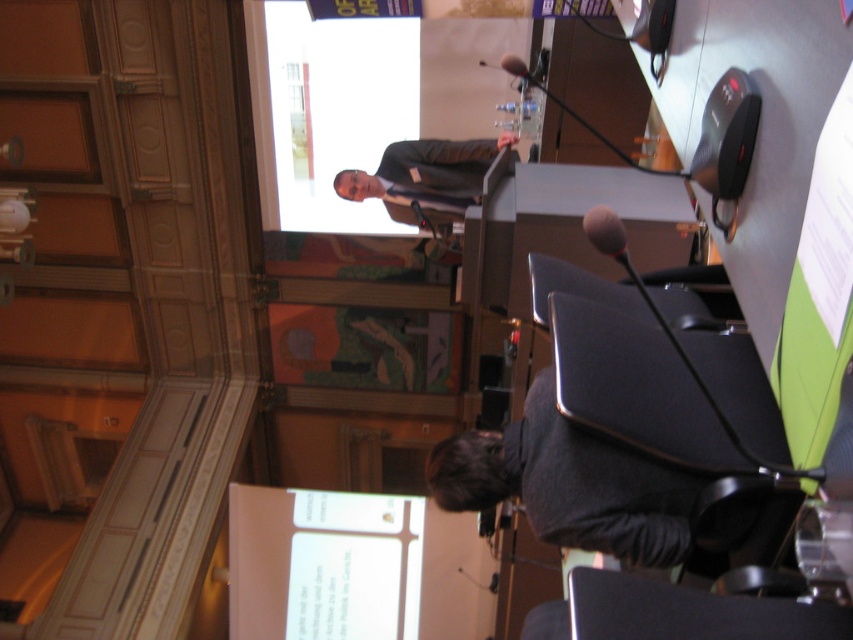
You are standing in the conference room and need to locate two specific points marked on the floor. The first point is at coordinate point(444, 483) and the second is at point(469, 161). Which point is closer to the large screen in the background?

Point(444, 483) is in front of point(469, 161), so it is closer to the large screen in the background.

You are attending a conference and need to present your slides. You see the dark gray sweater at lower center and the matte black suit at upper center in the room. Which object is closer to the large screen displaying the presentation slide?

The matte black suit at upper center is closer to the large screen displaying the presentation slide because it is positioned above the dark gray sweater at lower center, which is further away from the screen.